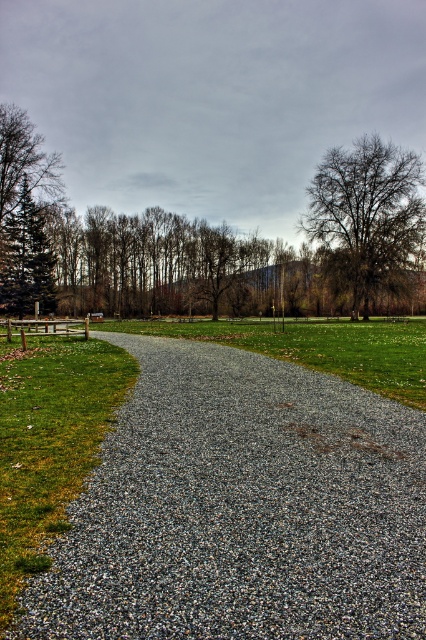
Question: Does green grass at left come in front of green matte tree at left?

Choices:
 (A) yes
 (B) no

Answer: (A)

Question: Estimate the real-world distances between objects in this image. Which object is farther from the gray gravel path at center?

Choices:
 (A) green matte tree at left
 (B) green grassy at center
 (C) green grass at left
 (D) bare branches at upper right

Answer: (A)

Question: Does green grass at left have a greater width compared to green grassy at center?

Choices:
 (A) no
 (B) yes

Answer: (A)

Question: In this image, where is gray gravel path at center located relative to green matte tree at left?

Choices:
 (A) below
 (B) above

Answer: (A)

Question: Which object appears closest to the camera in this image?

Choices:
 (A) green grassy at center
 (B) gray gravel path at center
 (C) green matte tree at left

Answer: (B)

Question: Which point appears farthest from the camera in this image?

Choices:
 (A) (351, 378)
 (B) (409, 157)
 (C) (385, 524)
 (D) (135, 372)

Answer: (B)